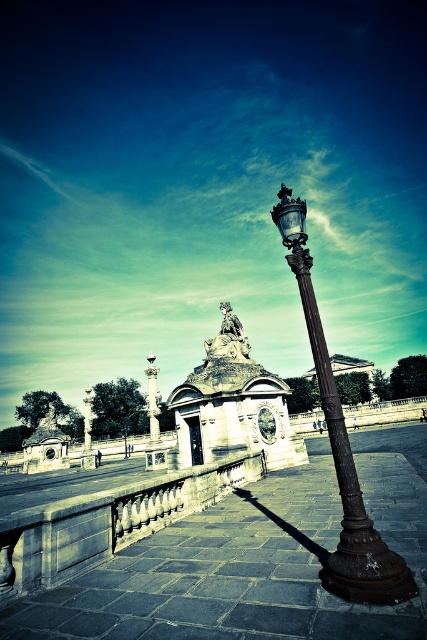
Question: Is bronze textured street light at center positioned in front of smooth white column at center?

Choices:
 (A) no
 (B) yes

Answer: (B)

Question: Which object appears farthest from the camera in this image?

Choices:
 (A) smooth white column at center
 (B) bronze textured street light at center

Answer: (A)

Question: Does bronze textured street light at center appear over smooth white column at center?

Choices:
 (A) no
 (B) yes

Answer: (B)

Question: Which point is farther to the camera?

Choices:
 (A) smooth white column at center
 (B) bronze textured street light at center

Answer: (A)

Question: Is bronze textured street light at center positioned at the back of smooth white column at center?

Choices:
 (A) no
 (B) yes

Answer: (A)

Question: Among these objects, which one is farthest from the camera?

Choices:
 (A) smooth white column at center
 (B) bronze textured street light at center

Answer: (A)